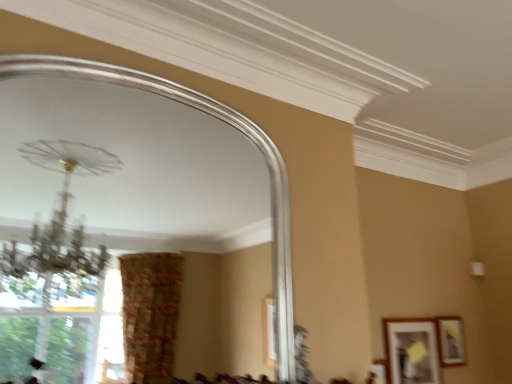
Question: Considering the relative sizes of silver metallic mirror at upper center and matte black picture frame at lower right, the 1th picture frame from the left, in the image provided, is silver metallic mirror at upper center wider than matte black picture frame at lower right, the 1th picture frame from the left,?

Choices:
 (A) no
 (B) yes

Answer: (B)

Question: From the image's perspective, is silver metallic mirror at upper center located beneath matte black picture frame at lower right, which is counted as the second picture frame, starting from the right?

Choices:
 (A) no
 (B) yes

Answer: (A)

Question: Is silver metallic mirror at upper center in front of matte black picture frame at lower right, the 1th picture frame from the left?

Choices:
 (A) yes
 (B) no

Answer: (A)

Question: Is matte black picture frame at lower right, which is counted as the second picture frame, starting from the right, a part of silver metallic mirror at upper center?

Choices:
 (A) no
 (B) yes

Answer: (A)

Question: From a real-world perspective, is silver metallic mirror at upper center below matte black picture frame at lower right, which is counted as the second picture frame, starting from the right?

Choices:
 (A) no
 (B) yes

Answer: (A)

Question: From their relative heights in the image, would you say silver metallic mirror at upper center is taller or shorter than matte black picture frame at lower right, the 1th picture frame from the left?

Choices:
 (A) tall
 (B) short

Answer: (A)

Question: Considering their positions, is silver metallic mirror at upper center located in front of or behind matte black picture frame at lower right, the 1th picture frame from the left?

Choices:
 (A) front
 (B) behind

Answer: (A)

Question: From a real-world perspective, is silver metallic mirror at upper center physically located above or below matte black picture frame at lower right, the 1th picture frame from the left?

Choices:
 (A) below
 (B) above

Answer: (B)

Question: Considering the positions of point (276, 327) and point (425, 354), is point (276, 327) closer or farther from the camera than point (425, 354)?

Choices:
 (A) closer
 (B) farther

Answer: (A)

Question: In terms of height, does matte gold picture frame at lower right, the first picture frame from the right, look taller or shorter compared to matte black picture frame at lower right, which is counted as the second picture frame, starting from the right?

Choices:
 (A) tall
 (B) short

Answer: (B)

Question: From the image's perspective, is matte gold picture frame at lower right, the first picture frame from the right, located above or below matte black picture frame at lower right, which is counted as the second picture frame, starting from the right?

Choices:
 (A) above
 (B) below

Answer: (A)

Question: From a real-world perspective, relative to matte black picture frame at lower right, which is counted as the second picture frame, starting from the right, is matte gold picture frame at lower right, the first picture frame from the right, vertically above or below?

Choices:
 (A) below
 (B) above

Answer: (B)

Question: Does point (455, 352) appear closer or farther from the camera than point (431, 382)?

Choices:
 (A) farther
 (B) closer

Answer: (A)

Question: Considering the positions of matte black picture frame at lower right, which is counted as the second picture frame, starting from the right, and matte gold picture frame at lower right, the first picture frame from the right, in the image, is matte black picture frame at lower right, which is counted as the second picture frame, starting from the right, wider or thinner than matte gold picture frame at lower right, the first picture frame from the right,?

Choices:
 (A) wide
 (B) thin

Answer: (B)

Question: From a real-world perspective, relative to matte gold picture frame at lower right, placed as the 2th picture frame when sorted from left to right, is matte black picture frame at lower right, which is counted as the second picture frame, starting from the right, vertically above or below?

Choices:
 (A) below
 (B) above

Answer: (A)